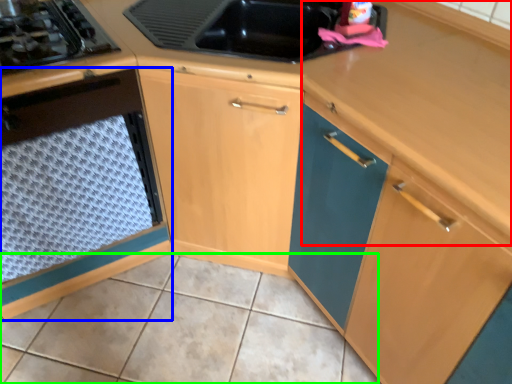
Question: Considering the real-world distances, which object is farthest from counter top (highlighted by a red box)? cabinetry (highlighted by a blue box) or tile (highlighted by a green box)?

Choices:
 (A) cabinetry
 (B) tile

Answer: (B)